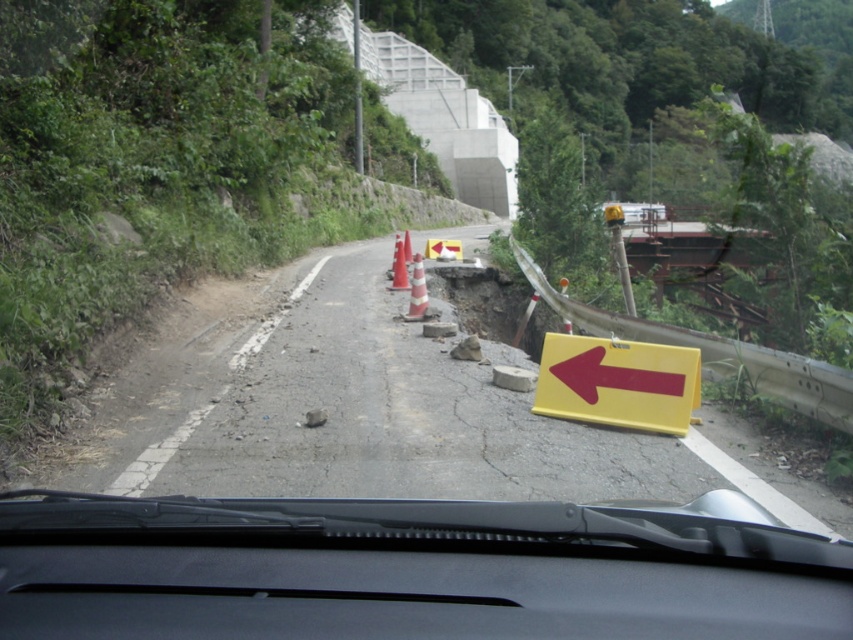
Does point (677, 426) come farther from viewer compared to point (584, 369)?

No, it is in front of (584, 369).

Is point (641, 362) closer to viewer compared to point (648, 376)?

No, it is behind (648, 376).

I want to click on yellow plastic sign at lower right, so 618,381.

Can you confirm if transparent plastic windshield at center is positioned to the left of red matte arrow at center?

Indeed, transparent plastic windshield at center is positioned on the left side of red matte arrow at center.

Does transparent plastic windshield at center have a lesser width compared to red matte arrow at center?

Incorrect, transparent plastic windshield at center's width is not less than red matte arrow at center's.

Find the location of a particular element. The image size is (853, 640). transparent plastic windshield at center is located at coordinates (405, 570).

Does yellow plastic sign at center have a larger size compared to orange/smooth/cone at center?

Yes.

Is point (374, 256) closer to camera compared to point (392, 268)?

No, it is not.

Where is `yellow plastic sign at center`? The width and height of the screenshot is (853, 640). yellow plastic sign at center is located at coordinates (386, 419).